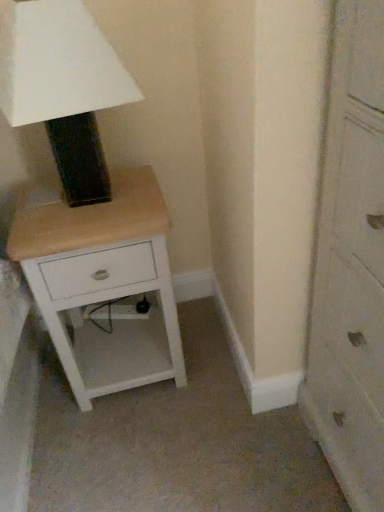
Where is `free region under matte black lampshade at upper left (from a real-world perspective)`? free region under matte black lampshade at upper left (from a real-world perspective) is located at coordinates (100, 203).